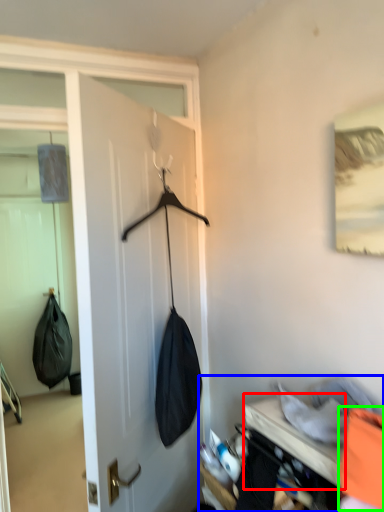
Question: Based on their relative distances, which object is farther from furniture (highlighted by a red box)? Choose from closet (highlighted by a blue box) and clothing (highlighted by a green box).

Choices:
 (A) closet
 (B) clothing

Answer: (B)